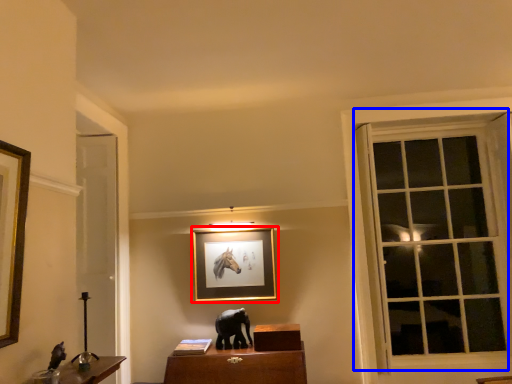
Question: Which object is further to the camera taking this photo, picture frame (highlighted by a red box) or window (highlighted by a blue box)?

Choices:
 (A) picture frame
 (B) window

Answer: (A)